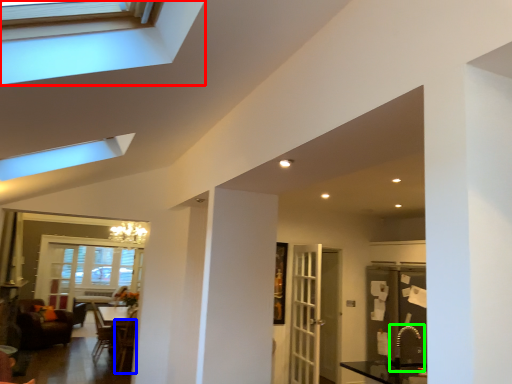
Question: Which object is positioned farthest from window (highlighted by a red box)? Select from armchair (highlighted by a blue box) and sink (highlighted by a green box).

Choices:
 (A) armchair
 (B) sink

Answer: (B)